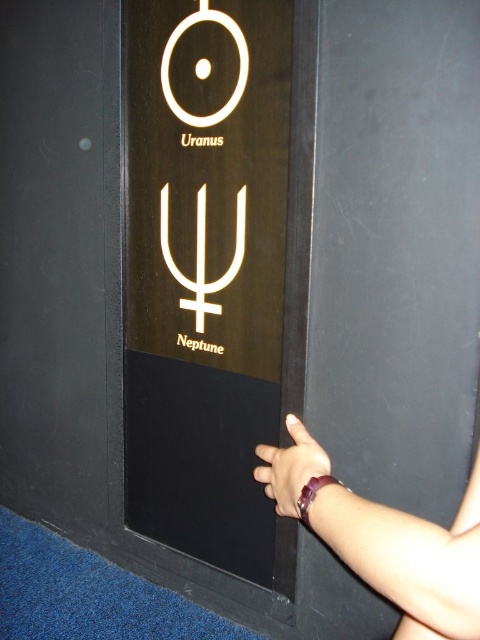
You are looking at an exhibit panel about planets. There is a hand touching the panel on the right side. Can you tell me what is at the point marked as coordinates (289, 467)?

At point (289, 467) is a purple fabric wristband at lower center.

You are designing a display panel for a space exhibit and want to ensure proper visibility of the white glossy trident at center and the purple fabric wristband at lower center. Given their sizes, which object should be placed higher up on the panel to ensure it doesn

The white glossy trident at center should be placed higher up on the panel since it has a greater height compared to the purple fabric wristband at lower center, ensuring better visibility.

You are an astronomer examining the exhibit panel. You notice the white glossy trident at center and the white circle at upper left. Which object is taller?

The white glossy trident at center is taller than the white circle at upper left.